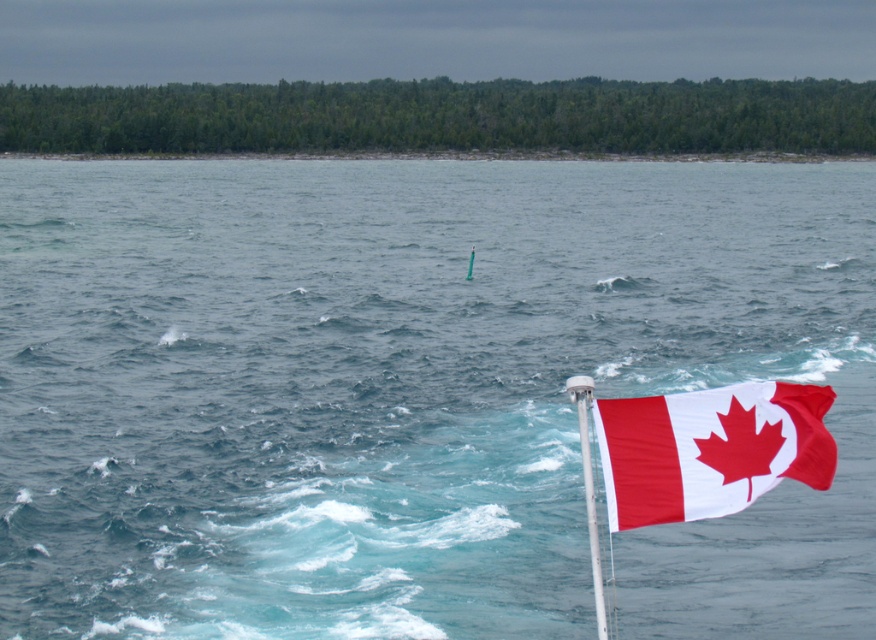
You are a sailor navigating a small boat and need to determine the direction to avoid hitting two points in the water. The first point is at coordinates point [737,406] and the second is at point [590,557]. Based on their positions, which point should you steer away from first to navigate safely?

You should steer away from point [737,406] first because it is in front of point [590,557], meaning it is closer to your current position.

You are a photographer trying to capture the Canadian flag in the scene. You notice the red fabric maple leaf flag at right and the white plastic pole at right. Which object takes up more area in the photo?

The white plastic pole at right takes up more area in the photo because the red fabric maple leaf flag at right occupies less space than the white plastic pole at right.

Based on the provided scene description, what are the coordinates of the red fabric maple leaf flag at right?

The red fabric maple leaf flag at right is located at coordinates [710,449].